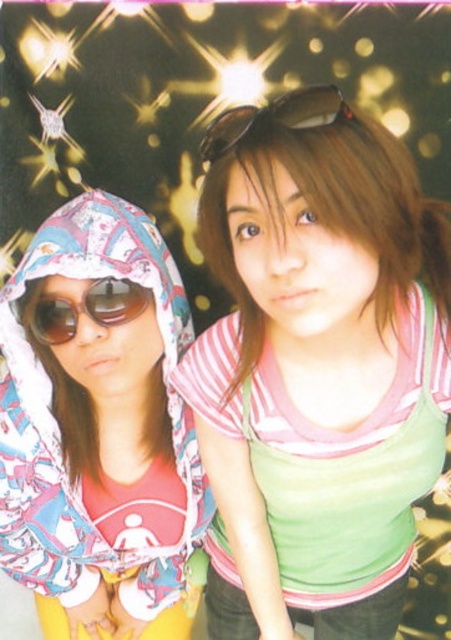
Question: Does printed fabric hoodie at left have a smaller size compared to sunglasses at left?

Choices:
 (A) yes
 (B) no

Answer: (B)

Question: Which object is the closest to the sunglasses at left?

Choices:
 (A) sunglasses at center
 (B) printed fabric hoodie at left

Answer: (B)

Question: Where is green fabric tank top at center located in relation to printed fabric hoodie at left in the image?

Choices:
 (A) above
 (B) below

Answer: (A)

Question: Considering the relative positions of green fabric tank top at center and printed fabric hoodie at left in the image provided, where is green fabric tank top at center located with respect to printed fabric hoodie at left?

Choices:
 (A) below
 (B) above

Answer: (B)

Question: Which object is the closest to the green fabric tank top at center?

Choices:
 (A) printed fabric hoodie at left
 (B) sunglasses at center

Answer: (A)

Question: Which object is the closest to the sunglasses at center?

Choices:
 (A) sunglasses at left
 (B) green fabric tank top at center
 (C) printed fabric hoodie at left

Answer: (A)